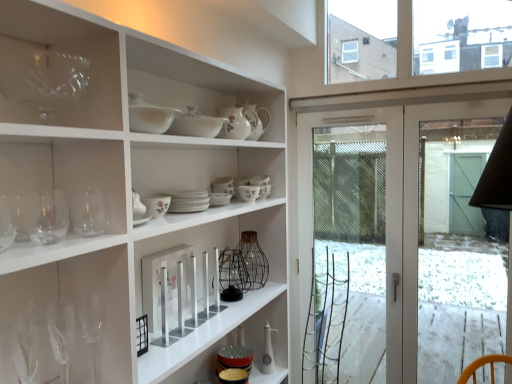
Question: From the image's perspective, is white ceramic bowl at upper center, the 1th tableware in the front-to-back sequence, positioned above or below white ceramic bowl at upper center, placed as the 6th tableware when sorted from back to front?

Choices:
 (A) above
 (B) below

Answer: (B)

Question: In the image, is white ceramic bowl at upper center, which is the 5th tableware in bottom-to-top order, on the left side or the right side of white ceramic bowl at upper center, placed as the 6th tableware when sorted from back to front?

Choices:
 (A) left
 (B) right

Answer: (A)

Question: Based on their relative distances, which object is farther from the matte white ceramic oil bottle at center, acting as the seventh tableware starting from the top?

Choices:
 (A) transparent glass wine glass at lower left, the 5th wine glass positioned from the front
 (B) floral ceramic bowl at center, the fourth tableware from the bottom
 (C) transparent glass at upper left
 (D) floral porcelain cup at center, the fifth tableware from the top
 (E) clear glass wine glass at lower left, which is counted as the third wine glass, starting from the front

Answer: (C)

Question: Which is farther from the porcelain floral teapot at center, marked as the fourth tableware in a front-to-back arrangement?

Choices:
 (A) matte white ceramic oil bottle at center, which is counted as the first tableware, starting from the bottom
 (B) transparent glass wine glass at lower left, the 1th wine glass positioned from the back
 (C) clear glass wine glass at left, positioned as the 1th wine glass in front-to-back order
 (D) floral ceramic bowl at center, the fourth tableware from the bottom
 (E) white ceramic plates at center, the 5th tableware in the back-to-front sequence

Answer: (A)